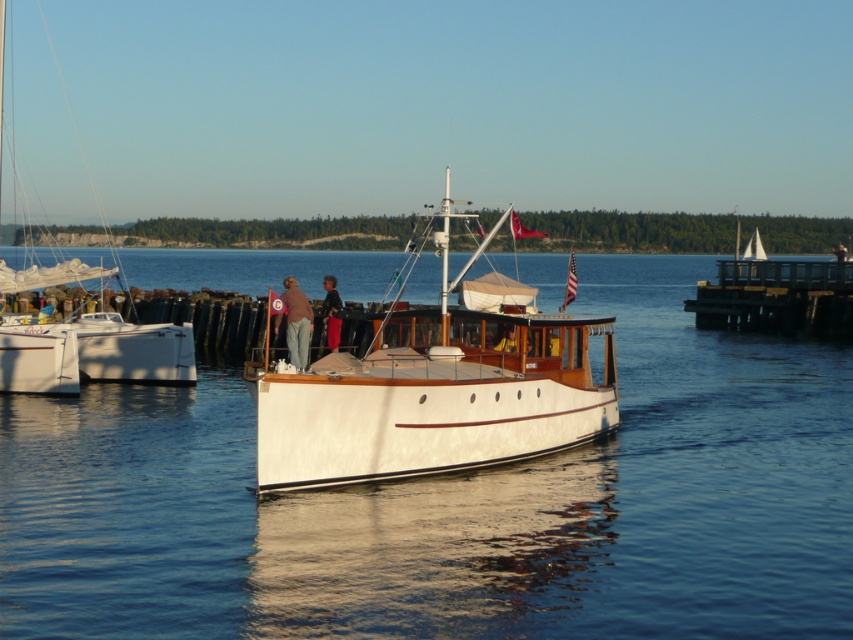
From the picture: You are a photographer planning to capture both the white glossy sailboat at left and the brown wooden dock at right in a single frame. Considering their sizes, which object would require you to adjust your camera angle to include its entirety without cropping?

The white glossy sailboat at left is bigger than the brown wooden dock at right, so you would need to adjust your camera angle to include the entirety of the white glossy sailboat at left without cropping.

You are standing at the point marked as point (x=131, y=358) in the marina scene. If you want to walk to the wooden pier where the motorboat is docked, which direction should you head?

The point (x=131, y=358) is 27.34 meters away from the viewer. Since the wooden pier is where the motorboat is docked, you should head towards the direction of the wooden pier to reach it from your current position.

You are a photographer wanting to capture both the white glossy sailboat at left and the brown wooden dock at right in a single frame. Given their widths, which object should you position closer to the center of your camera viewfinder to ensure both fit without cropping?

The white glossy sailboat at left is wider than the brown wooden dock at right. To ensure both fit in the frame, position the white glossy sailboat at left closer to the center of the camera viewfinder since it is wider and requires more space.